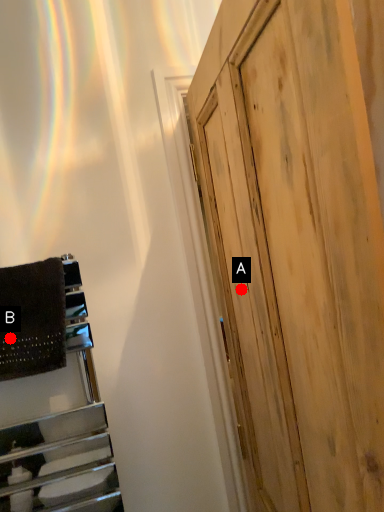
Question: Two points are circled on the image, labeled by A and B beside each circle. Which point is farther from the camera taking this photo?

Choices:
 (A) A is further
 (B) B is further

Answer: (B)